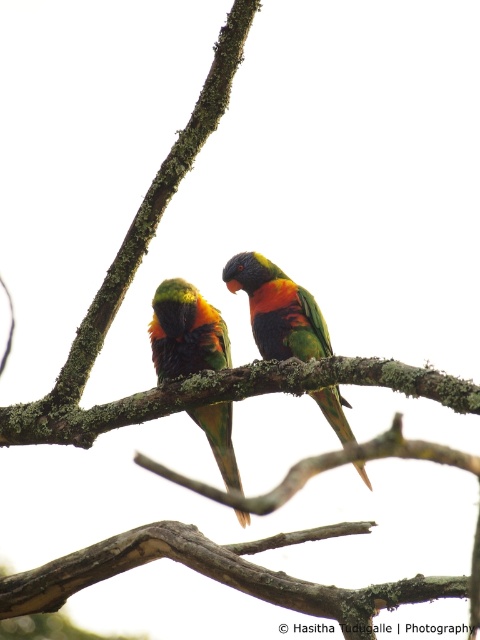
Is multicolored feathered parrot at center smaller than rainbow feathered parrot at center?

Yes.

What do you see at coordinates (186, 332) in the screenshot?
I see `multicolored feathered parrot at center` at bounding box center [186, 332].

Is point (223, 420) closer to viewer compared to point (342, 413)?

Yes, point (223, 420) is in front of point (342, 413).

I want to click on multicolored feathered parrot at center, so click(x=186, y=332).